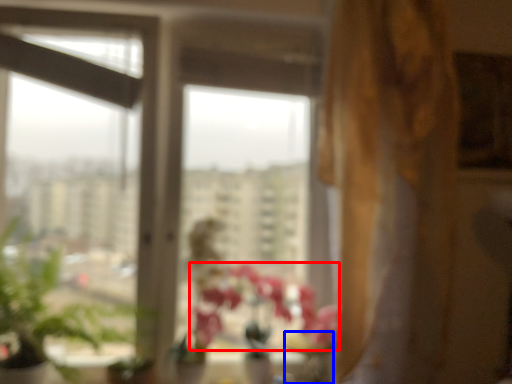
Question: Among these objects, which one is nearest to the camera, flower (highlighted by a red box) or glass vase (highlighted by a blue box)?

Choices:
 (A) flower
 (B) glass vase

Answer: (A)